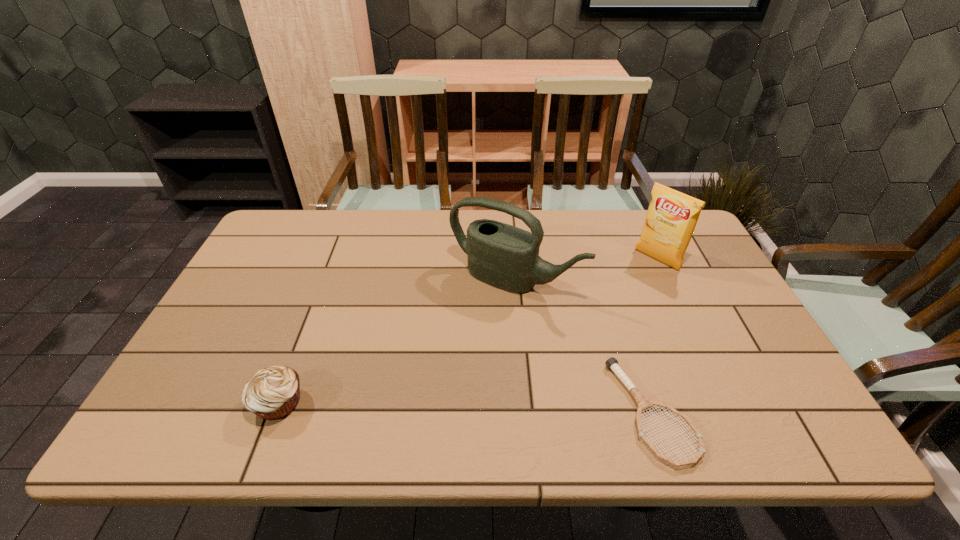
The image size is (960, 540). I want to click on the second shortest object, so click(272, 393).

This screenshot has width=960, height=540. What are the coordinates of `the leftmost object` in the screenshot? It's located at (272, 393).

Where is `the second object from right to left`? This screenshot has width=960, height=540. the second object from right to left is located at coordinates (644, 403).

At what (x,y) coordinates should I click in order to perform the action: click on the shortest object. Please return your answer as a coordinate pair (x, y). Looking at the image, I should click on (644, 403).

Find the location of a particular element. Image resolution: width=960 pixels, height=540 pixels. crisp (potato chip) is located at coordinates (672, 216).

What are the coordinates of `the second object from left to right` in the screenshot? It's located at click(x=502, y=255).

Image resolution: width=960 pixels, height=540 pixels. In order to click on vacant space located on the back of the leftmost object in this screenshot , I will do `click(316, 306)`.

Identify the location of blank space located on the back of the second object from right to left. The image size is (960, 540). (628, 338).

I want to click on free space located 0.070m on the front of the crisp (potato chip) with the logo, so click(x=634, y=280).

Where is `vacant space located on the front of the crisp (potato chip) with the logo`? vacant space located on the front of the crisp (potato chip) with the logo is located at coordinates (630, 283).